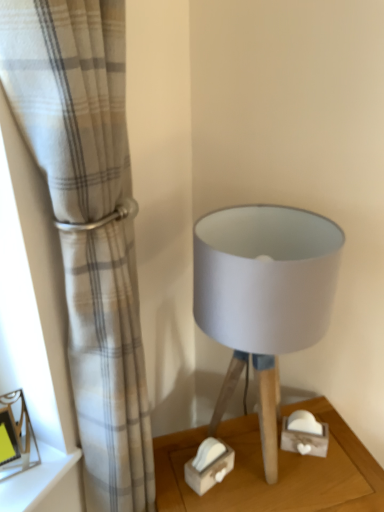
Question: Considering the positions of point (112, 371) and point (188, 468), is point (112, 371) closer or farther from the camera than point (188, 468)?

Choices:
 (A) closer
 (B) farther

Answer: (A)

Question: Is white textured curtain at left wider or thinner than wooden tissue box at lower center?

Choices:
 (A) thin
 (B) wide

Answer: (B)

Question: Which object is the closest to the wooden tissue box at lower center?

Choices:
 (A) matte gray fabric lampshade at center
 (B) wooden table at lower right
 (C) metallic gold picture frame at lower left
 (D) white textured curtain at left
 (E) matte white frame at lower left

Answer: (B)

Question: Estimate the real-world distances between objects in this image. Which object is farther from the matte gray fabric lampshade at center?

Choices:
 (A) wooden tissue box at lower center
 (B) matte white frame at lower left
 (C) white textured curtain at left
 (D) metallic gold picture frame at lower left
 (E) wooden table at lower right

Answer: (D)